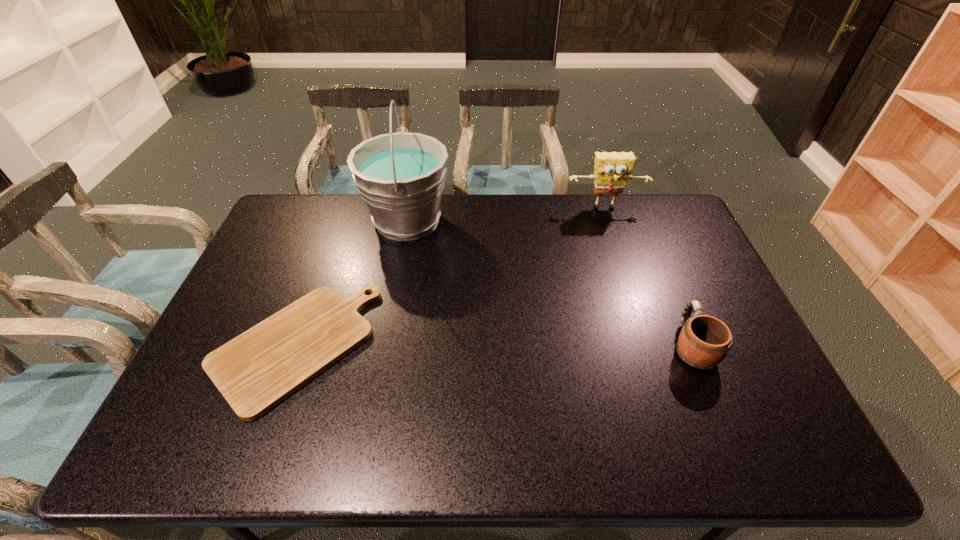
Locate an element on the screen. The image size is (960, 540). object that is the second nearest to the chopping board is located at coordinates coord(612,170).

At what (x,y) coordinates should I click in order to perform the action: click on free space that satisfies the following two spatial constraints: 1. on the back side of the shortest object; 2. on the right side of the tallest object. Please return your answer as a coordinate pair (x, y). Looking at the image, I should click on (339, 221).